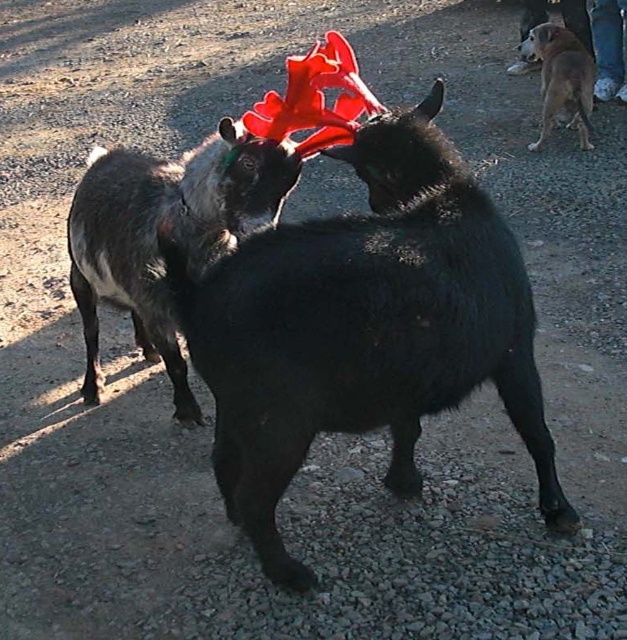
Question: Considering the relative positions of black matte antlers at center and dark gray woolen goat at center in the image provided, where is black matte antlers at center located with respect to dark gray woolen goat at center?

Choices:
 (A) above
 (B) below

Answer: (B)

Question: Among these points, which one is farthest from the camera?

Choices:
 (A) (567, 116)
 (B) (312, 358)

Answer: (A)

Question: Which point is farther to the camera?

Choices:
 (A) brown furry dog at upper right
 (B) black matte antlers at center

Answer: (A)

Question: Does dark gray woolen goat at center come behind brown furry dog at upper right?

Choices:
 (A) no
 (B) yes

Answer: (A)

Question: Is the position of dark gray woolen goat at center less distant than that of brown furry dog at upper right?

Choices:
 (A) yes
 (B) no

Answer: (A)

Question: Which object is positioned closest to the dark gray woolen goat at center?

Choices:
 (A) black matte antlers at center
 (B) brown furry dog at upper right

Answer: (A)